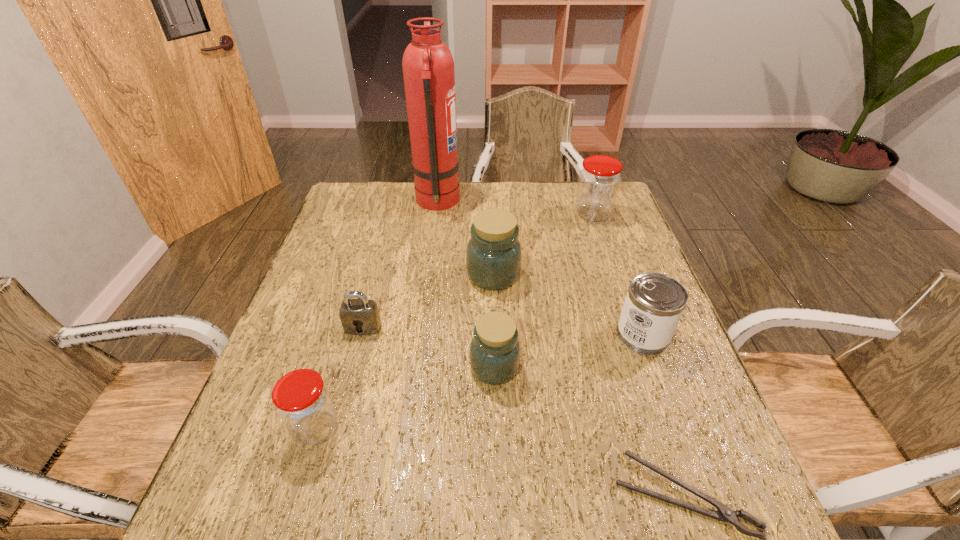
Locate an element on the screen. The image size is (960, 540). vacant position in the image that satisfies the following two spatial constraints: 1. on the label side of the tallest object; 2. on the left side of the right red jar is located at coordinates (436, 214).